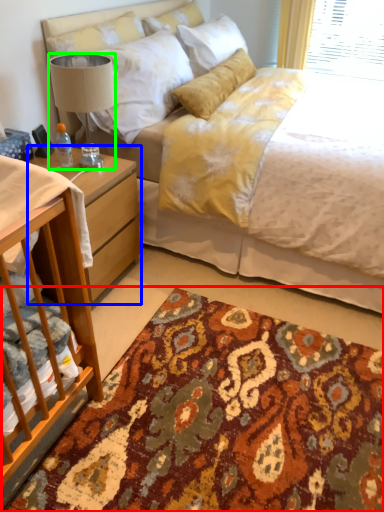
Question: Based on their relative distances, which object is farther from mat (highlighted by a red box)? Choose from nightstand (highlighted by a blue box) and lamp (highlighted by a green box).

Choices:
 (A) nightstand
 (B) lamp

Answer: (B)